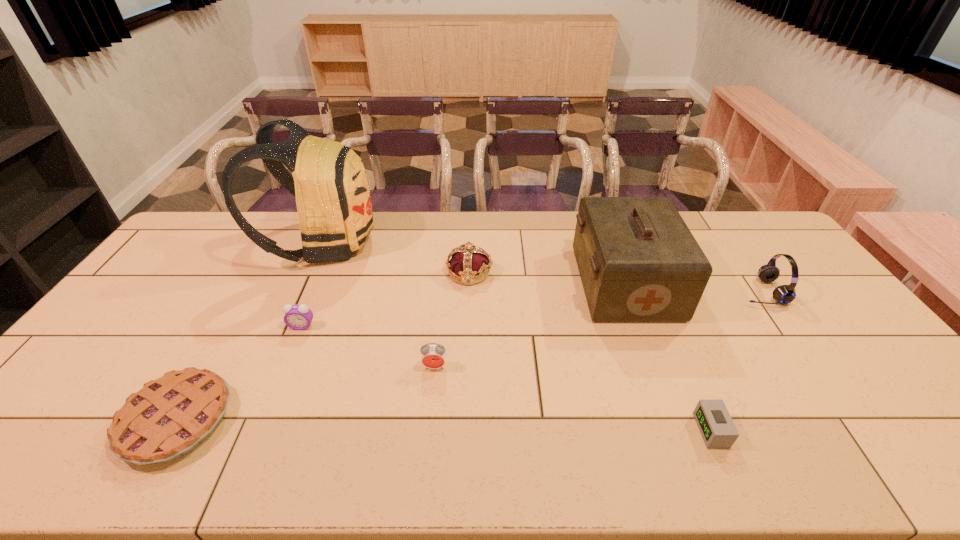
Find the location of a particular element. free space between the rightmost object and the tallest object is located at coordinates (541, 267).

Locate an element on the screen. This screenshot has width=960, height=540. object identified as the fifth closest to the crown is located at coordinates (169, 417).

Identify which object is the fifth closest to the nearest alarm clock. Please provide its 2D coordinates. Your answer should be formatted as a tuple, i.e. [(x, y)], where the tuple contains the x and y coordinates of a point satisfying the conditions above.

[(329, 181)]

Identify which alarm clock is located as the nearest to the rightmost alarm clock. Please provide its 2D coordinates. Your answer should be formatted as a tuple, i.e. [(x, y)], where the tuple contains the x and y coordinates of a point satisfying the conditions above.

[(433, 355)]

Point out which alarm clock is positioned as the nearest to the nearest alarm clock. Please provide its 2D coordinates. Your answer should be formatted as a tuple, i.e. [(x, y)], where the tuple contains the x and y coordinates of a point satisfying the conditions above.

[(433, 355)]

The image size is (960, 540). Find the location of `free spot that satisfies the following two spatial constraints: 1. on the front-facing side of the tallest object; 2. on the right side of the second tallest object`. free spot that satisfies the following two spatial constraints: 1. on the front-facing side of the tallest object; 2. on the right side of the second tallest object is located at coordinates pos(305,284).

Identify the location of vacant space that satisfies the following two spatial constraints: 1. on the ear cushions of the headset; 2. on the face of the second tallest alarm clock. The image size is (960, 540). (784, 326).

This screenshot has width=960, height=540. I want to click on free location that satisfies the following two spatial constraints: 1. on the front-facing side of the backpack; 2. on the right side of the first-aid kit, so click(305, 284).

At what (x,y) coordinates should I click in order to perform the action: click on vacant point that satisfies the following two spatial constraints: 1. on the front-facing side of the tallest object; 2. on the back side of the crown. Please return your answer as a coordinate pair (x, y). Looking at the image, I should click on pyautogui.click(x=310, y=273).